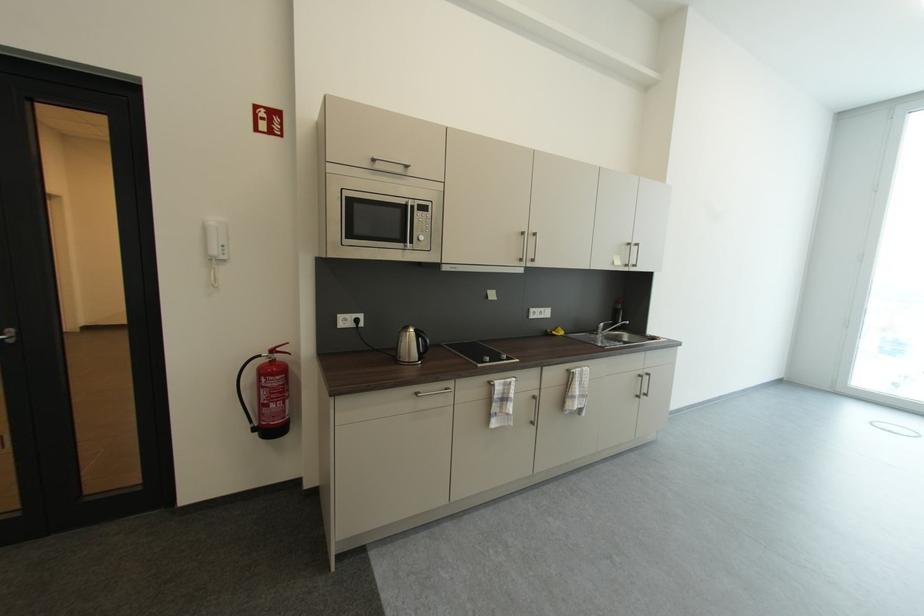
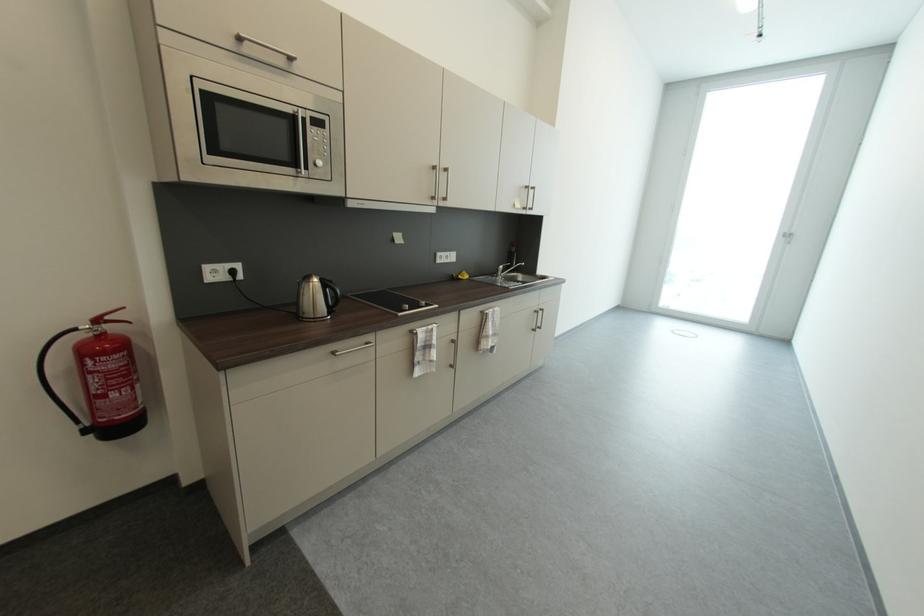
In the second image, find the point that corresponds to point (410, 205) in the first image.

(297, 113)